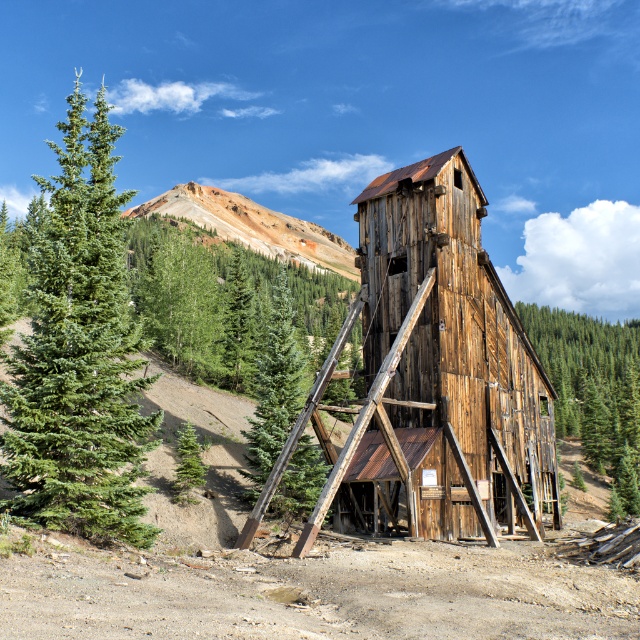
Question: Which point is farther to the camera?

Choices:
 (A) green matte tree at lower left
 (B) rusty wood ladder at center

Answer: (A)

Question: Can you confirm if weathered wood tower at center is wider than green matte tree at center?

Choices:
 (A) yes
 (B) no

Answer: (A)

Question: Which of the following is the closest to the observer?

Choices:
 (A) (152, 200)
 (B) (300, 547)
 (C) (284, 388)

Answer: (B)

Question: Which object is farther from the camera taking this photo?

Choices:
 (A) rusty wood ladder at center
 (B) weathered wood tower at center
 (C) green matte tree at lower left
 (D) green rough wood tree at center

Answer: (D)

Question: Is weathered wood tower at center closer to the viewer compared to rustic brown mountain at upper center?

Choices:
 (A) no
 (B) yes

Answer: (B)

Question: Is green fir tree at left positioned at the back of green matte tree at lower left?

Choices:
 (A) yes
 (B) no

Answer: (B)